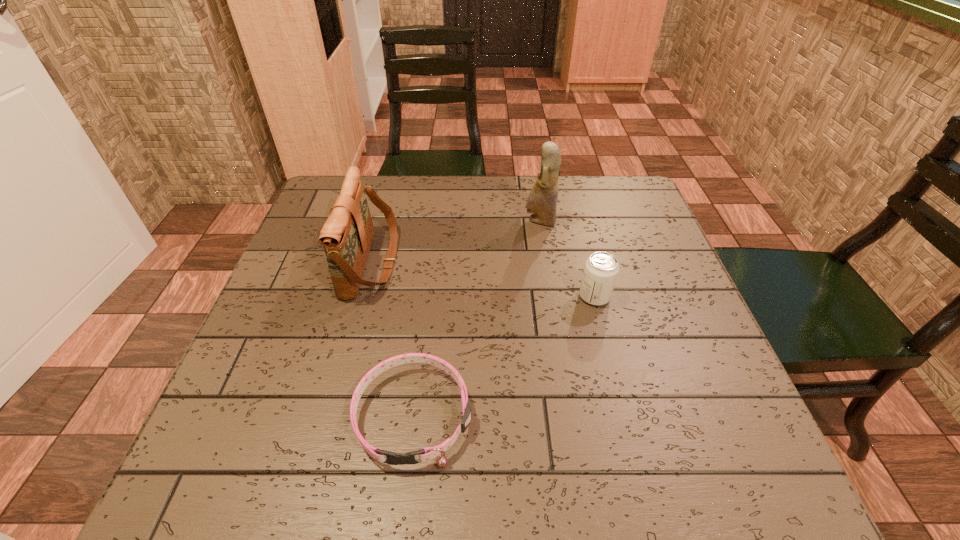
Locate an element on the screen. This screenshot has width=960, height=540. free space located 0.200m on the front-facing side of the second tallest object is located at coordinates (481, 262).

Locate an element on the screen. The height and width of the screenshot is (540, 960). vacant space located 0.390m on the back of the third tallest object is located at coordinates (567, 189).

Locate an element on the screen. The height and width of the screenshot is (540, 960). object situated at the far edge is located at coordinates (542, 200).

Find the location of a particular element. This screenshot has width=960, height=540. object that is at the near edge is located at coordinates pos(425,454).

Locate an element on the screen. The width and height of the screenshot is (960, 540). object that is at the left edge is located at coordinates (346, 236).

You are a GUI agent. You are given a task and a screenshot of the screen. Output one action in this format:
    pyautogui.click(x=<x>, y=<y>)
    Task: Click on the free location at the far edge
    
    Given the screenshot: What is the action you would take?
    pyautogui.click(x=478, y=220)

Locate an element on the screen. The width and height of the screenshot is (960, 540). vacant space at the near edge of the desktop is located at coordinates (438, 436).

You are a GUI agent. You are given a task and a screenshot of the screen. Output one action in this format:
    pyautogui.click(x=<x>, y=<y>)
    Task: Click on the blank space at the left edge
    This screenshot has width=960, height=540.
    Given the screenshot: What is the action you would take?
    click(271, 310)

The height and width of the screenshot is (540, 960). I want to click on free space at the right edge, so click(x=604, y=235).

The height and width of the screenshot is (540, 960). In order to click on vacant space at the far left corner of the desktop in this screenshot , I will do `click(376, 176)`.